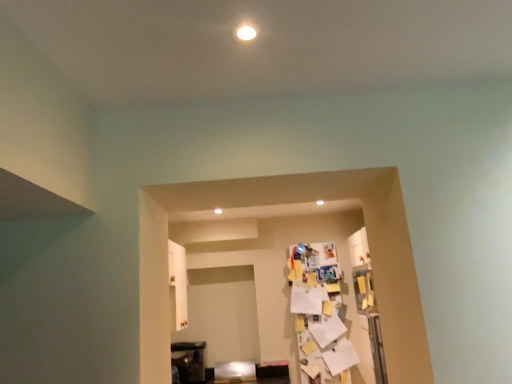
Question: Considering their positions, is metallic dark brown cabinet at lower left, the 1th furniture from the left, located in front of or behind metallic silver fridge at lower center, the 1th furniture from the right?

Choices:
 (A) behind
 (B) front

Answer: (A)

Question: From a real-world perspective, is metallic dark brown cabinet at lower left, the 1th furniture from the left, physically located above or below metallic silver fridge at lower center, the 1th furniture from the right?

Choices:
 (A) below
 (B) above

Answer: (B)

Question: In terms of size, does metallic dark brown cabinet at lower left, marked as the 2th furniture in a right-to-left arrangement, appear bigger or smaller than metallic silver fridge at lower center, the 1th furniture from the right?

Choices:
 (A) small
 (B) big

Answer: (B)

Question: Is metallic silver fridge at lower center, placed as the second furniture when sorted from left to right, taller or shorter than metallic dark brown cabinet at lower left, the 1th furniture from the left?

Choices:
 (A) tall
 (B) short

Answer: (B)

Question: From a real-world perspective, is metallic silver fridge at lower center, the 1th furniture from the right, positioned above or below metallic dark brown cabinet at lower left, marked as the 2th furniture in a right-to-left arrangement?

Choices:
 (A) above
 (B) below

Answer: (B)

Question: Would you say metallic silver fridge at lower center, the 1th furniture from the right, is inside or outside metallic dark brown cabinet at lower left, the 1th furniture from the left?

Choices:
 (A) inside
 (B) outside

Answer: (B)

Question: Is point pos(216,372) closer or farther from the camera than point pos(180,377)?

Choices:
 (A) closer
 (B) farther

Answer: (B)